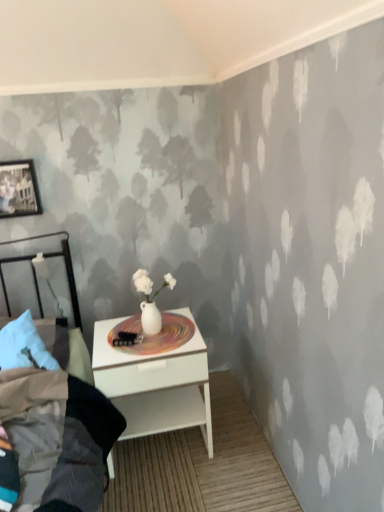
At what (x,y) coordinates should I click in order to perform the action: click on blank area beneath white glossy nightstand at lower center (from a real-world perspective). Please return your answer as a coordinate pair (x, y). The image size is (384, 512). Looking at the image, I should click on (159, 446).